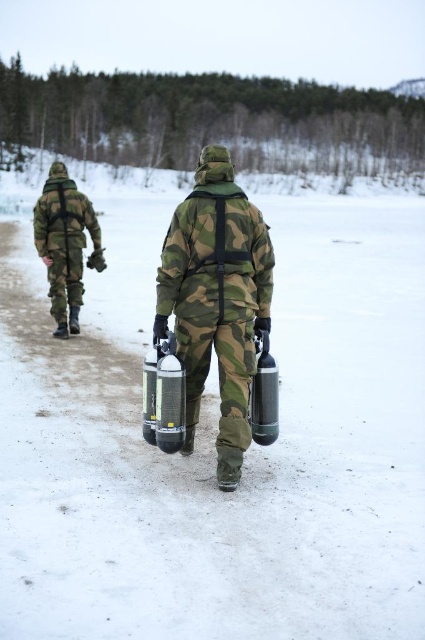
Question: Which point is closer to the camera taking this photo?

Choices:
 (A) (277, 396)
 (B) (257, 330)

Answer: (A)

Question: Is white matte snow at center thinner than metallic silver cylinder at center?

Choices:
 (A) yes
 (B) no

Answer: (B)

Question: Which of the following is the farthest from the observer?

Choices:
 (A) metallic silver cylinder at center
 (B) metallic silver extinguisher at center
 (C) camo fabric uniform at center
 (D) camouflage fabric uniform at left

Answer: (D)

Question: Which of these objects is positioned closest to the camouflage fabric uniform at left?

Choices:
 (A) metallic silver extinguisher at center
 (B) metallic silver cylinder at center
 (C) white matte snow at center

Answer: (A)

Question: Is metallic silver extinguisher at center above metallic silver cylinder at center?

Choices:
 (A) no
 (B) yes

Answer: (A)

Question: Can you confirm if camo fabric uniform at center is positioned below camouflage fabric uniform at left?

Choices:
 (A) no
 (B) yes

Answer: (B)